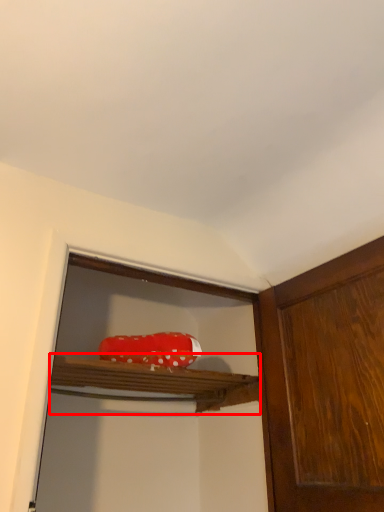
Question: From the image's perspective, what is the correct spatial relationship of cabinet (annotated by the red box) in relation to stuff?

Choices:
 (A) below
 (B) above

Answer: (A)